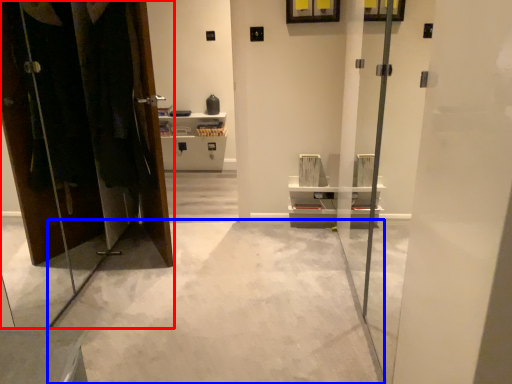
Question: Which of the following is the farthest to the observer, dresser (highlighted by a red box) or concrete (highlighted by a blue box)?

Choices:
 (A) dresser
 (B) concrete

Answer: (B)